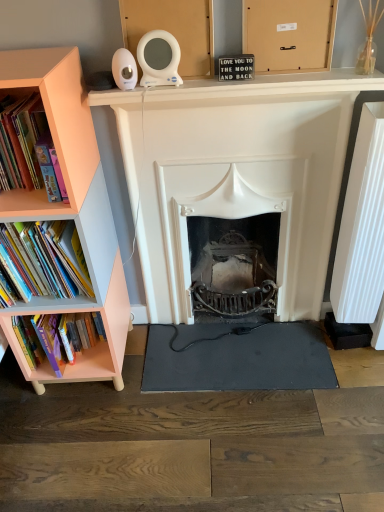
Find the location of a particular element. free location in front of black rubber yoga mat at center is located at coordinates (243, 454).